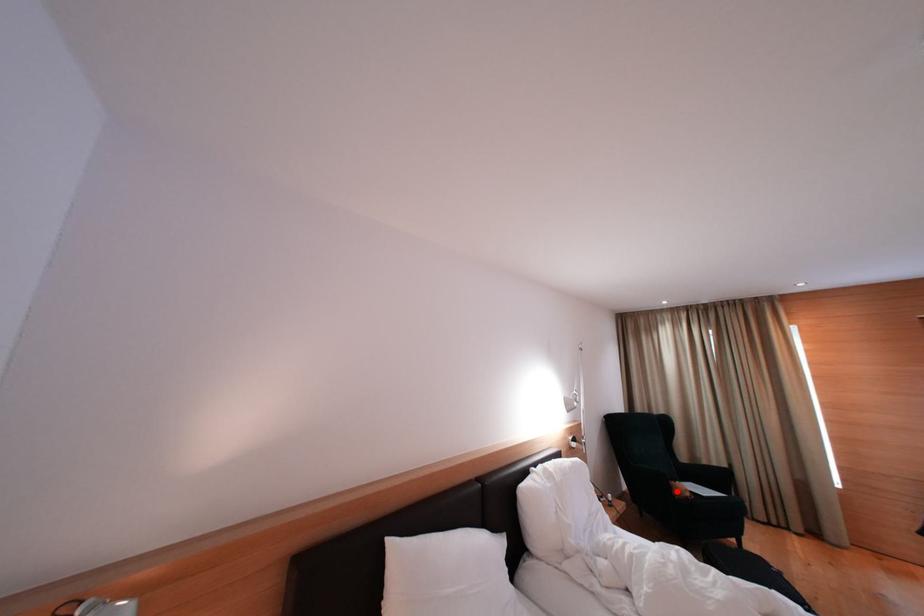
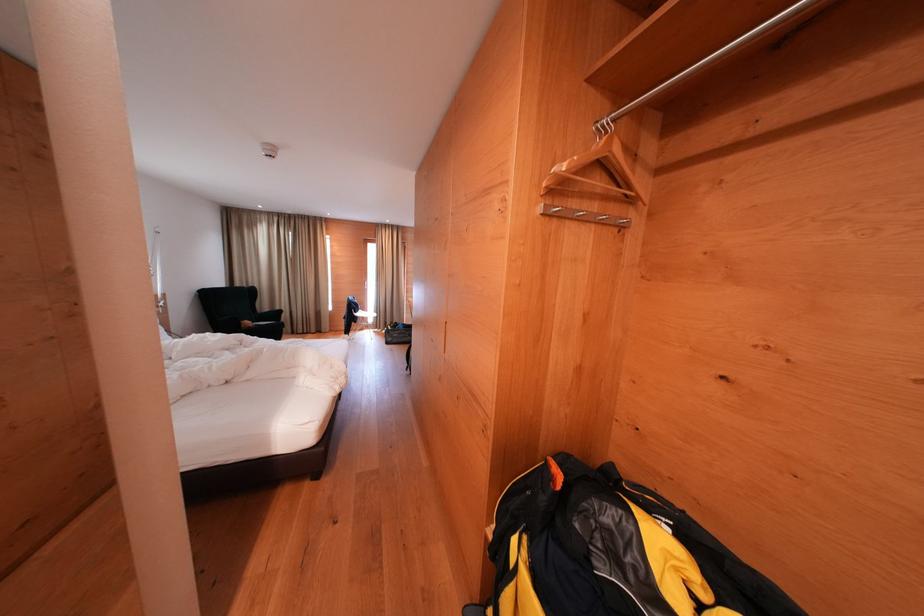
Find the pixel in the second image that matches the highlighted location in the first image.

(247, 329)